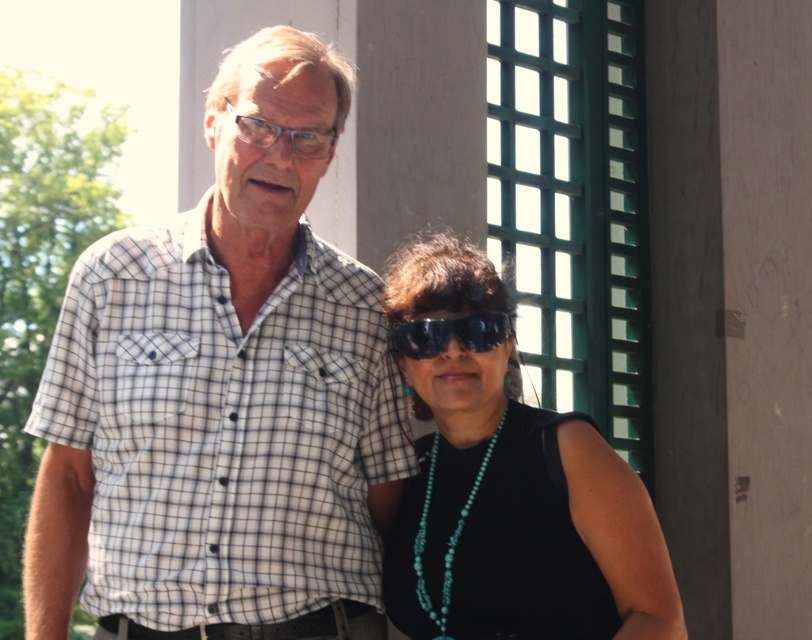
Question: Which object is closer to the camera taking this photo?

Choices:
 (A) turquoise beaded necklace at center
 (B) white checkered shirt at center
 (C) black plastic goggles at center

Answer: (A)

Question: Where is white checkered shirt at center located in relation to black plastic goggles at center in the image?

Choices:
 (A) above
 (B) below

Answer: (B)

Question: Which of these objects is positioned closest to the black plastic goggles at center?

Choices:
 (A) white checkered shirt at center
 (B) turquoise beaded necklace at center

Answer: (B)

Question: Is turquoise beaded necklace at center thinner than black plastic goggles at center?

Choices:
 (A) no
 (B) yes

Answer: (A)

Question: Can you confirm if white checkered shirt at center is positioned to the left of black plastic goggles at center?

Choices:
 (A) no
 (B) yes

Answer: (B)

Question: Which of these objects is positioned farthest from the turquoise beaded necklace at center?

Choices:
 (A) black plastic goggles at center
 (B) white checkered shirt at center

Answer: (B)